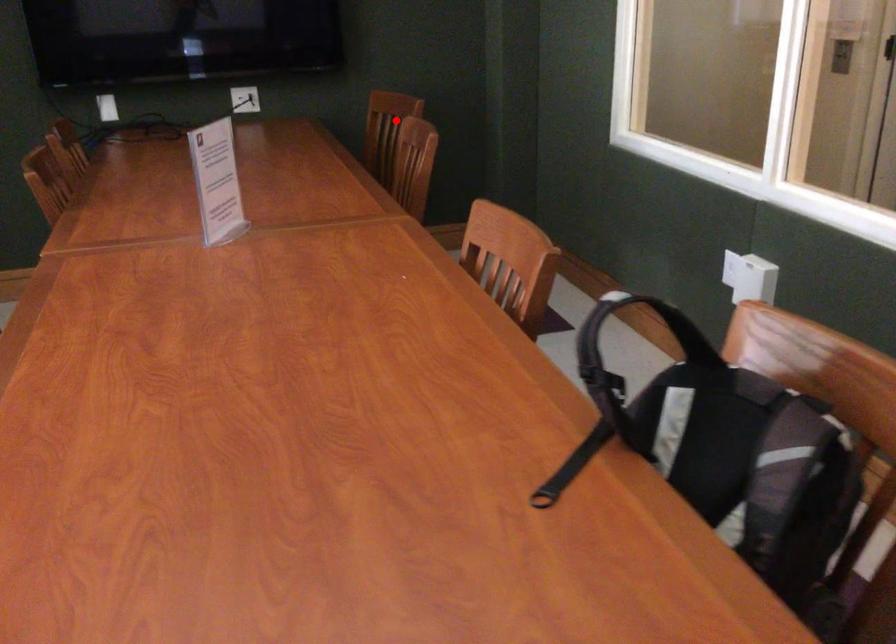
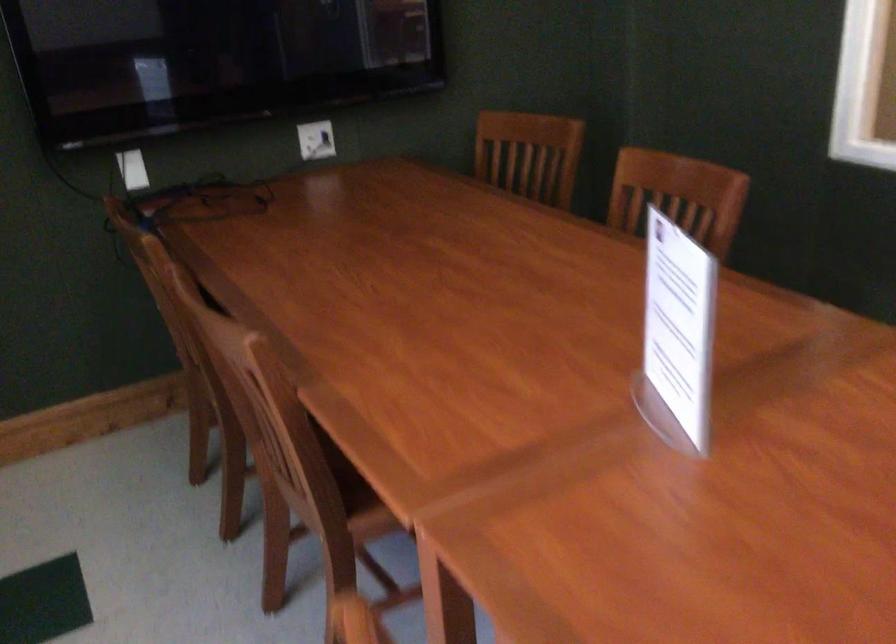
Question: I am providing you with two images of the same scene from different viewpoints. A red point is marked on the first image. At the location where the point appears in image 1, is it still visible in image 2?

Choices:
 (A) Yes
 (B) No

Answer: (A)